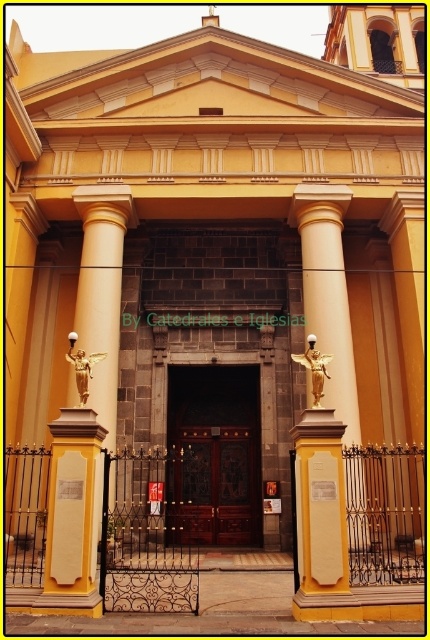
Who is positioned more to the right, gold metallic angel at right or gold metallic statue at center?

gold metallic angel at right is more to the right.

Between point (313, 378) and point (80, 381), which one is positioned behind?

Positioned behind is point (80, 381).

Who is more distant from viewer, (x=316, y=400) or (x=68, y=355)?

The point (x=68, y=355) is more distant.

Identify the location of gold metallic angel at right. (313, 368).